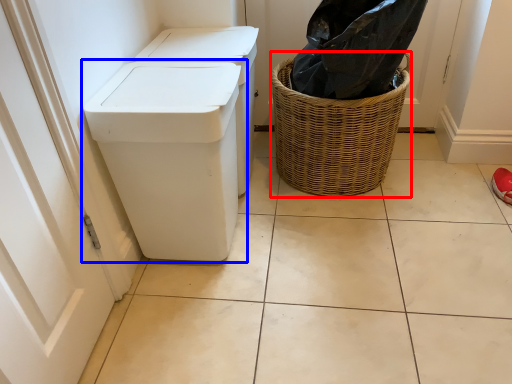
Question: Which of the following is the farthest to the observer, basket (highlighted by a red box) or waste container (highlighted by a blue box)?

Choices:
 (A) basket
 (B) waste container

Answer: (A)